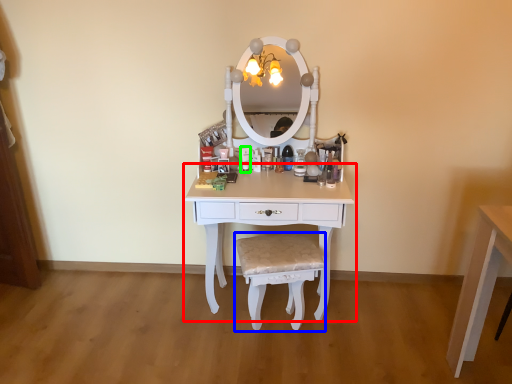
Question: Which object is positioned closest to table (highlighted by a red box)? Select from chair (highlighted by a blue box) and toiletry (highlighted by a green box).

Choices:
 (A) chair
 (B) toiletry

Answer: (A)